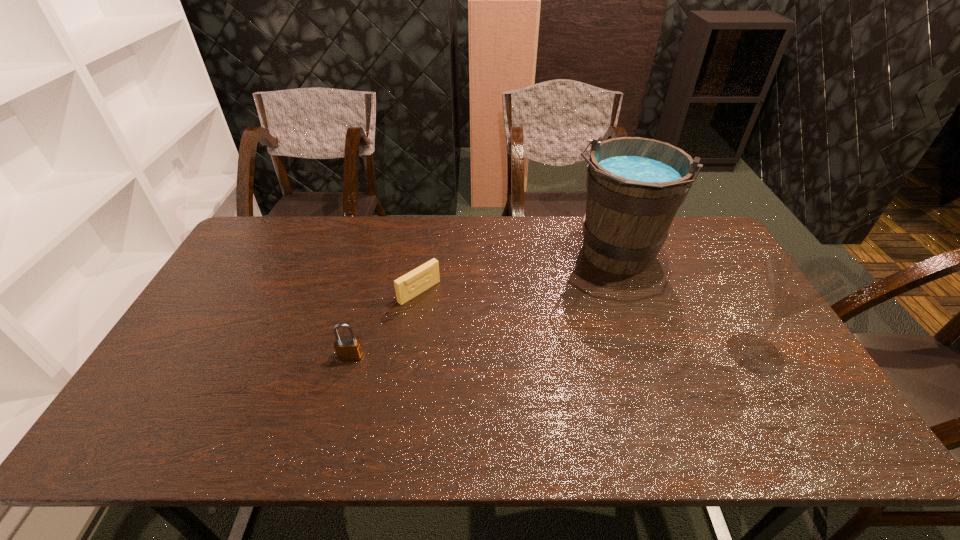
I want to click on free area in between the flute glass and the tallest object, so click(x=684, y=305).

This screenshot has width=960, height=540. Find the location of `vacant point located between the flute glass and the second object from right to left`. vacant point located between the flute glass and the second object from right to left is located at coordinates (684, 305).

In order to click on vacant area that lies between the second object from right to left and the leftmost object in this screenshot , I will do `click(483, 306)`.

This screenshot has width=960, height=540. I want to click on free spot between the second object from right to left and the second tallest object, so click(x=684, y=305).

This screenshot has width=960, height=540. What are the coordinates of `free space between the flute glass and the tallest object` in the screenshot? It's located at (684, 305).

Identify which object is the third closest to the wine bucket. Please provide its 2D coordinates. Your answer should be formatted as a tuple, i.e. [(x, y)], where the tuple contains the x and y coordinates of a point satisfying the conditions above.

[(347, 348)]

You are a GUI agent. You are given a task and a screenshot of the screen. Output one action in this format:
    pyautogui.click(x=<x>, y=<y>)
    Task: Click on the object that can be found as the third closest to the tallest object
    The height and width of the screenshot is (540, 960).
    Given the screenshot: What is the action you would take?
    pyautogui.click(x=347, y=348)

Identify the location of free space that satisfies the following two spatial constraints: 1. on the back side of the shortest object; 2. on the left side of the tallest object. The height and width of the screenshot is (540, 960). (424, 255).

Identify the location of vacant area that satisfies the following two spatial constraints: 1. on the back side of the second shortest object; 2. on the right side of the rightmost object. (351, 353).

I want to click on vacant position in the image that satisfies the following two spatial constraints: 1. on the back side of the wine bucket; 2. on the right side of the leftmost object, so click(x=378, y=255).